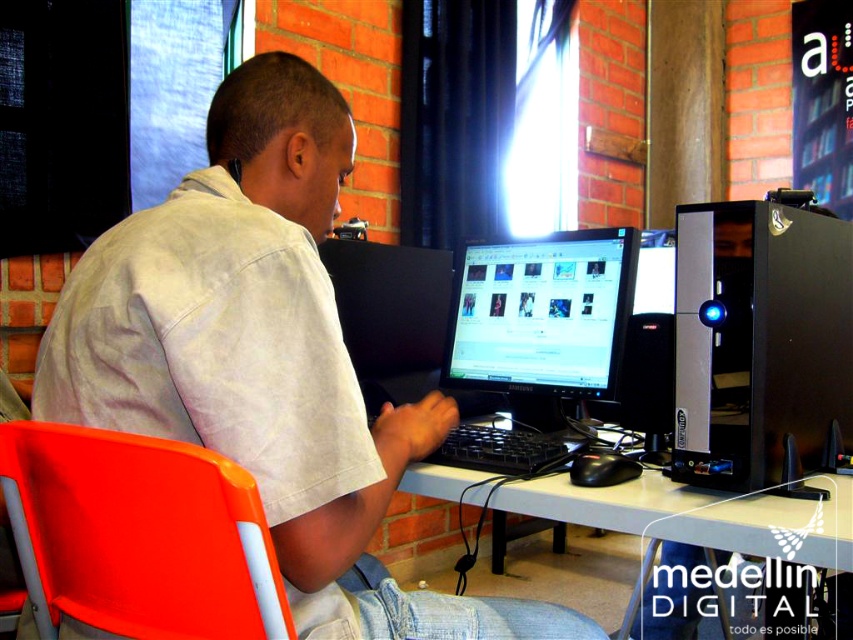
Question: Can you confirm if matte white shirt at center is positioned to the right of black glossy monitor at center?

Choices:
 (A) yes
 (B) no

Answer: (B)

Question: Which object appears closest to the camera in this image?

Choices:
 (A) black plastic desktop computer at right
 (B) white plastic computer desk at center
 (C) matte white shirt at center

Answer: (C)

Question: Based on their relative distances, which object is farther from the white plastic computer desk at center?

Choices:
 (A) black glossy monitor at center
 (B) matte white shirt at center

Answer: (A)

Question: Does matte white shirt at center have a larger size compared to black glossy monitor at center?

Choices:
 (A) yes
 (B) no

Answer: (A)

Question: Which is nearer to the black glossy monitor at center?

Choices:
 (A) matte white shirt at center
 (B) orange plastic chair at lower left

Answer: (A)

Question: Is black plastic desktop computer at right above black glossy monitor at center?

Choices:
 (A) yes
 (B) no

Answer: (B)